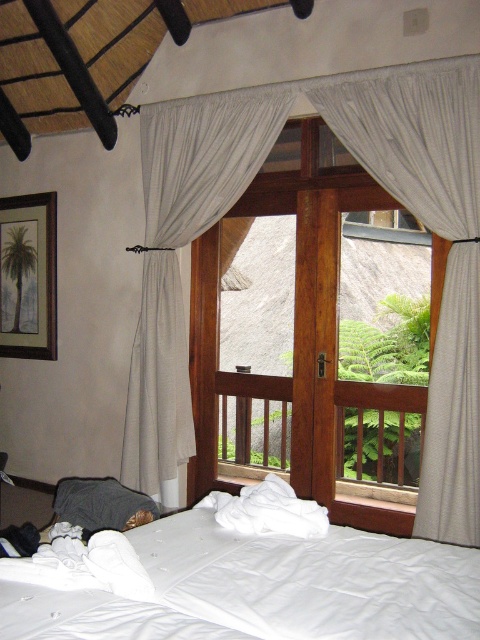
You are a painter who needs to hang a 1.5 meter tall painting on the wall. The wooden door at center and the white textured curtain at center are in your way. Which one do you need to move to make space for the painting?

The wooden door at center is shorter than the white textured curtain at center, so you need to move the white textured curtain at center to make space for the 1.5 meter tall painting since it is taller than the door.

You are standing in the bedroom and want to check the view outside the window. Which curtain, the white textured curtain at center or the white sheer curtain at center, should you move aside to get a clearer view?

The white sheer curtain at center should be moved aside for a clearer view because the white textured curtain at center is smaller and might not fully clear the window when moved.